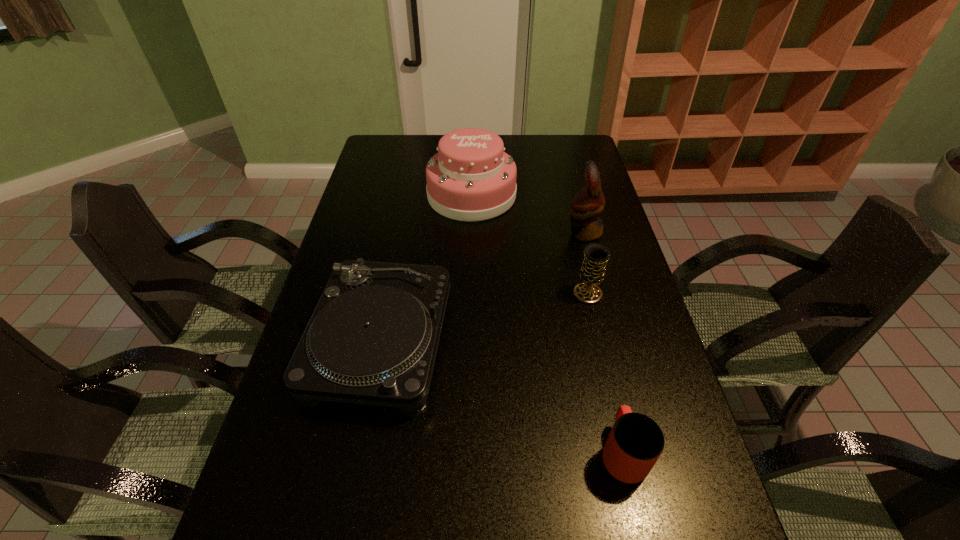
This screenshot has width=960, height=540. Find the location of `blank space located on the front of the chalice`. blank space located on the front of the chalice is located at coordinates (599, 342).

Locate an element on the screen. vacant space positioned on the front of the record player is located at coordinates (349, 501).

Where is `vacant point located on the handle side of the cup`? The height and width of the screenshot is (540, 960). vacant point located on the handle side of the cup is located at coordinates (601, 357).

Identify the location of free location located 0.180m on the handle side of the cup. (600, 354).

At what (x,y) coordinates should I click in order to perform the action: click on free space located 0.200m on the handle side of the cup. Please return your answer as a coordinate pair (x, y). Looking at the image, I should click on (598, 348).

What are the coordinates of `object that is positioned at the left edge` in the screenshot? It's located at (372, 339).

Identify the location of parrot present at the right edge. The height and width of the screenshot is (540, 960). (589, 202).

Find the location of `chalice at the right edge`. chalice at the right edge is located at coordinates (596, 255).

Find the location of a particular element. This screenshot has width=960, height=540. cup located at the right edge is located at coordinates (635, 443).

Find the location of a particular element. The image size is (960, 540). free space at the far edge of the desktop is located at coordinates (526, 152).